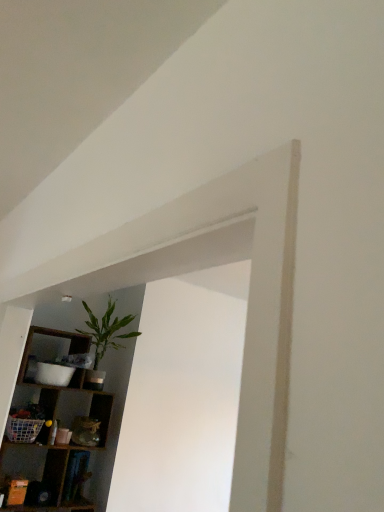
Question: Considering the positions of green leafy plant at upper left and wooden shelf at left in the image, is green leafy plant at upper left wider or thinner than wooden shelf at left?

Choices:
 (A) thin
 (B) wide

Answer: (A)

Question: Is point (112, 336) positioned closer to the camera than point (69, 348)?

Choices:
 (A) closer
 (B) farther

Answer: (B)

Question: Which is correct: green leafy plant at upper left is inside wooden shelf at left, or outside of it?

Choices:
 (A) outside
 (B) inside

Answer: (A)

Question: Is wooden shelf at left in front of or behind green leafy plant at upper left in the image?

Choices:
 (A) front
 (B) behind

Answer: (A)

Question: Would you say wooden shelf at left is to the left or to the right of green leafy plant at upper left in the picture?

Choices:
 (A) left
 (B) right

Answer: (A)

Question: From a real-world perspective, is wooden shelf at left positioned above or below green leafy plant at upper left?

Choices:
 (A) below
 (B) above

Answer: (A)

Question: From their relative heights in the image, would you say wooden shelf at left is taller or shorter than green leafy plant at upper left?

Choices:
 (A) short
 (B) tall

Answer: (B)